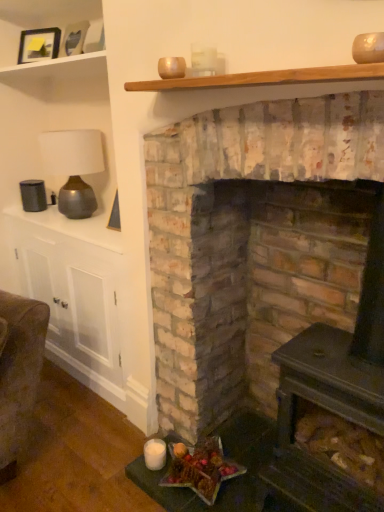
The width and height of the screenshot is (384, 512). Find the location of `free spot behind shiny metallic star at lower center`. free spot behind shiny metallic star at lower center is located at coordinates (213, 436).